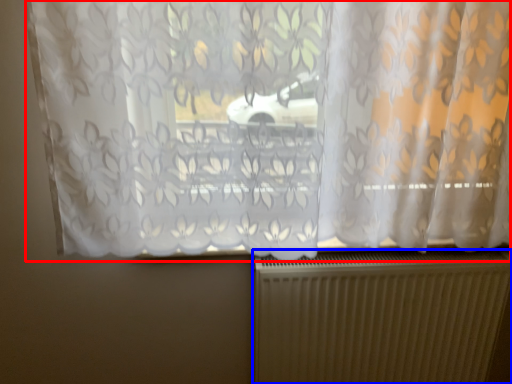
Question: Which of the following is the closest to the observer, curtain (highlighted by a red box) or radiator (highlighted by a blue box)?

Choices:
 (A) curtain
 (B) radiator

Answer: (A)